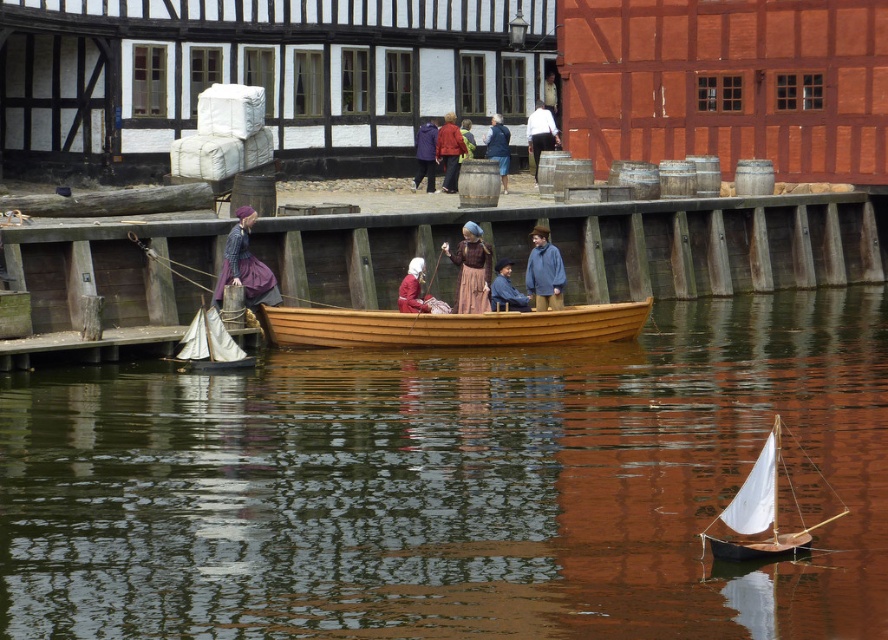
Question: Observing the image, what is the correct spatial positioning of white sailboat at lower right in reference to wooden sailboat at center?

Choices:
 (A) above
 (B) below

Answer: (B)

Question: Which is nearer to the wooden dock at center?

Choices:
 (A) white sailboat at lower right
 (B) blue woolen jacket at center

Answer: (B)

Question: Does purple fabric coat at center appear on the right side of matte brown coat at center?

Choices:
 (A) no
 (B) yes

Answer: (A)

Question: Does brown fabric dress at center appear under white cotton shirt at center?

Choices:
 (A) no
 (B) yes

Answer: (B)

Question: Which point is closer to the camera taking this photo?

Choices:
 (A) (501, 180)
 (B) (235, 358)
 (C) (740, 220)

Answer: (B)

Question: Which point is closer to the camera taking this photo?

Choices:
 (A) (496, 140)
 (B) (836, 432)
 (C) (538, 140)

Answer: (B)